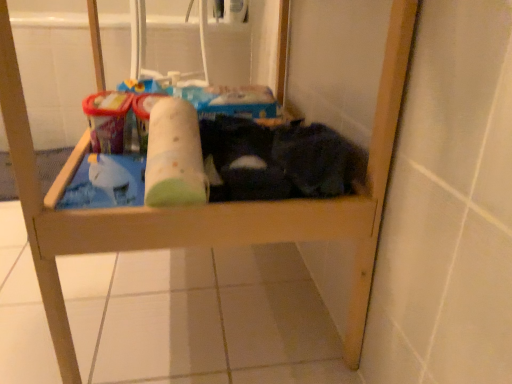
Question: Is green fabric toilet paper at center outside of dark fabric laundry at lower right?

Choices:
 (A) yes
 (B) no

Answer: (A)

Question: Is green fabric toilet paper at center facing towards dark fabric laundry at lower right?

Choices:
 (A) yes
 (B) no

Answer: (B)

Question: Is green fabric toilet paper at center smaller than dark fabric laundry at lower right?

Choices:
 (A) yes
 (B) no

Answer: (A)

Question: Is green fabric toilet paper at center shorter than dark fabric laundry at lower right?

Choices:
 (A) no
 (B) yes

Answer: (B)

Question: Are green fabric toilet paper at center and dark fabric laundry at lower right located far from each other?

Choices:
 (A) yes
 (B) no

Answer: (B)

Question: Considering the relative positions of green fabric toilet paper at center and dark fabric laundry at lower right in the image provided, is green fabric toilet paper at center to the left of dark fabric laundry at lower right from the viewer's perspective?

Choices:
 (A) no
 (B) yes

Answer: (B)

Question: Is dark fabric laundry at lower right next to green fabric toilet paper at center and touching it?

Choices:
 (A) yes
 (B) no

Answer: (B)

Question: From the image's perspective, is dark fabric laundry at lower right located above green fabric toilet paper at center?

Choices:
 (A) yes
 (B) no

Answer: (A)

Question: Can you confirm if dark fabric laundry at lower right is positioned to the left of green fabric toilet paper at center?

Choices:
 (A) no
 (B) yes

Answer: (A)

Question: Is dark fabric laundry at lower right behind green fabric toilet paper at center?

Choices:
 (A) yes
 (B) no

Answer: (A)

Question: Considering the relative sizes of dark fabric laundry at lower right and green fabric toilet paper at center in the image provided, is dark fabric laundry at lower right smaller than green fabric toilet paper at center?

Choices:
 (A) no
 (B) yes

Answer: (A)

Question: Is dark fabric laundry at lower right closer to the viewer compared to green fabric toilet paper at center?

Choices:
 (A) yes
 (B) no

Answer: (B)

Question: Do you think green fabric toilet paper at center is within dark fabric laundry at lower right, or outside of it?

Choices:
 (A) outside
 (B) inside

Answer: (A)